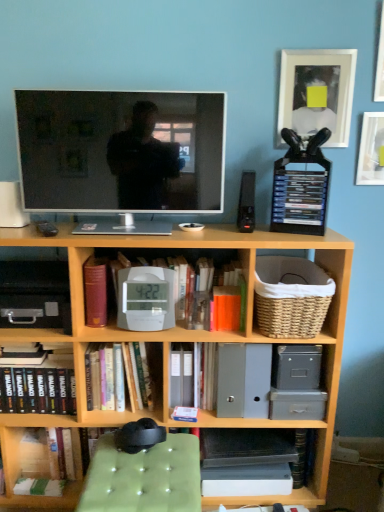
Question: Considering their positions, is white plastic alarm clock at center located in front of or behind white glossy picture frame at upper right, placed as the 1th picture frame when sorted from left to right?

Choices:
 (A) behind
 (B) front

Answer: (B)

Question: Considering the positions of white plastic alarm clock at center and white glossy picture frame at upper right, placed as the 1th picture frame when sorted from left to right, in the image, is white plastic alarm clock at center taller or shorter than white glossy picture frame at upper right, placed as the 1th picture frame when sorted from left to right,?

Choices:
 (A) short
 (B) tall

Answer: (A)

Question: Based on their relative distances, which object is farther from the white plastic clock at center, which is the 3th book in left-to-right order?

Choices:
 (A) maroon leather book at center-left, the 2th paperback book in the right-to-left sequence
 (B) black plastic speaker at upper right
 (C) white matte picture frame at upper right, which appears as the second picture frame when viewed from the left
 (D) matte black tv at center
 (E) white glossy picture frame at upper right, placed as the 1th picture frame when sorted from left to right

Answer: (C)

Question: Which is farther from the hardcover book at lower left, arranged as the first book when viewed from the left?

Choices:
 (A) orange matte paperback book at center, which is counted as the second paperback book, starting from the left
 (B) black plastic speaker at upper right
 (C) hardcover book at center, arranged as the 2th book when viewed from the left
 (D) maroon leather book at center-left, which is the first paperback book from left to right
 (E) green fabric ottoman at lower center

Answer: (B)